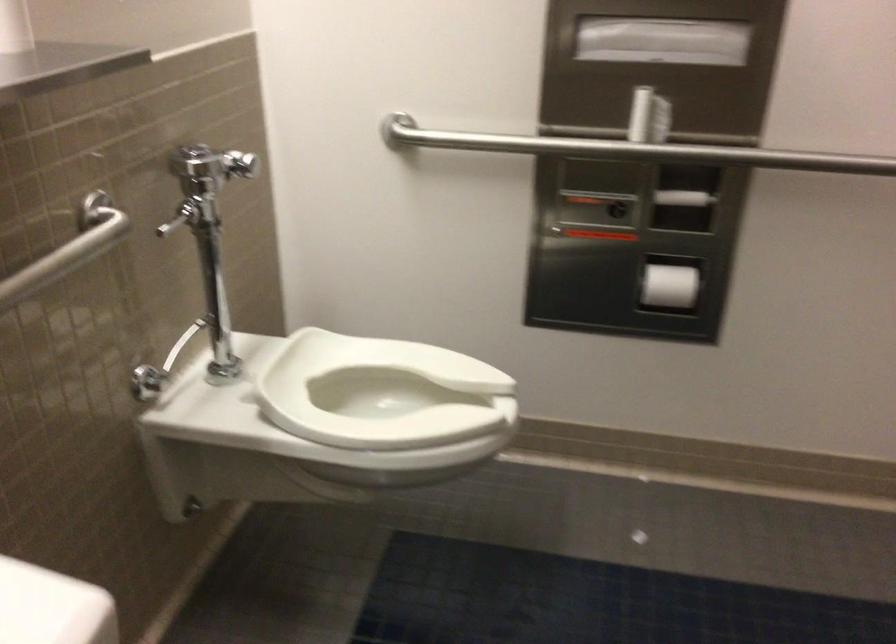
Find where to lift the white toilet seat. Please return your answer as a coordinate pair (x, y).

(381, 393)